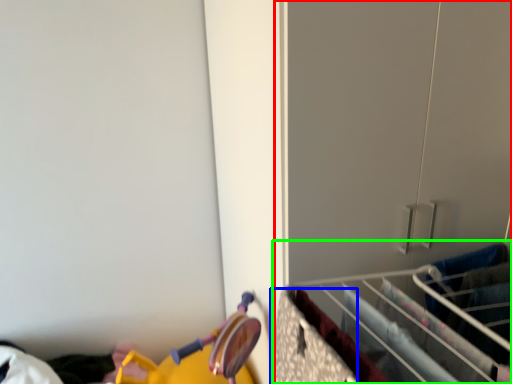
Question: Which object is the closest to the closet (highlighted by a red box)? Choose among these: drawer (highlighted by a blue box) or closet (highlighted by a green box).

Choices:
 (A) drawer
 (B) closet

Answer: (B)